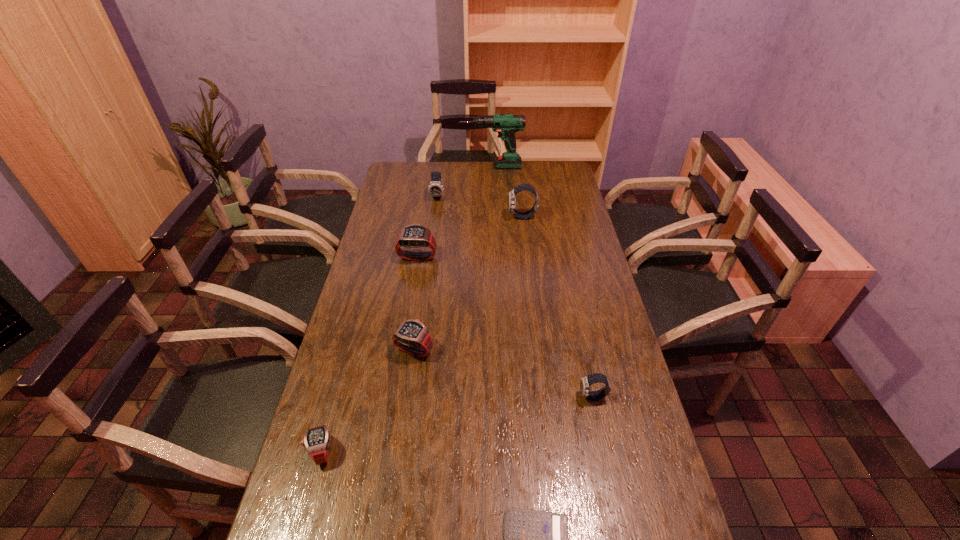
Where is `free space located 0.270m on the right of the biggest red watch`? The image size is (960, 540). free space located 0.270m on the right of the biggest red watch is located at coordinates (508, 256).

This screenshot has width=960, height=540. I want to click on blank area located on the face of the farthest watch, so click(436, 213).

Identify the location of free space located 0.340m on the back of the second farthest red watch. (425, 268).

Find the location of a particular element. vacant space positioned on the face of the rightmost dark watch is located at coordinates (479, 397).

At what (x,y) coordinates should I click in order to perform the action: click on vacant space located on the face of the rightmost dark watch. Please return your answer as a coordinate pair (x, y). The width and height of the screenshot is (960, 540). Looking at the image, I should click on (471, 397).

Identify the location of free spot located on the face of the rightmost dark watch. (446, 397).

At what (x,y) coordinates should I click in order to perform the action: click on vacant area located 0.150m on the back of the leftmost red watch. Please return your answer as a coordinate pair (x, y). Looking at the image, I should click on (340, 385).

At what (x,y) coordinates should I click in order to perform the action: click on object present at the far edge. Please return your answer as a coordinate pair (x, y). The height and width of the screenshot is (540, 960). Looking at the image, I should click on 506,125.

Identify the location of object that is at the right edge. (585, 382).

Where is `blank space at the far edge of the desktop`? blank space at the far edge of the desktop is located at coordinates (430, 183).